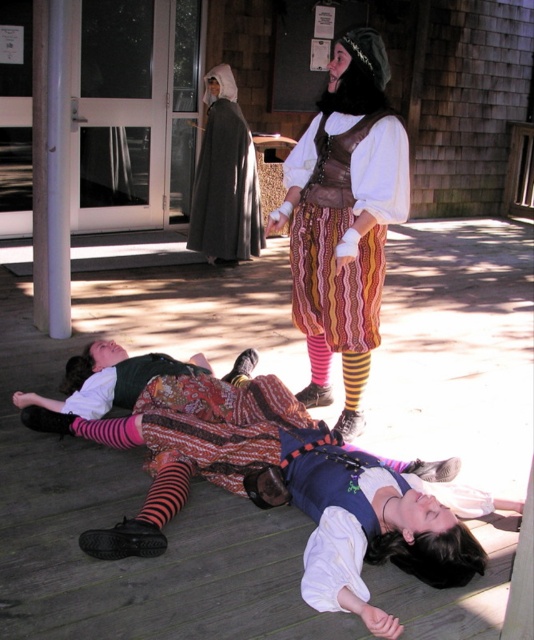
Question: Among these objects, which one is farthest from the camera?

Choices:
 (A) dark gray woolen cloak at center
 (B) pink striped sock at lower center
 (C) black striped sock at center

Answer: (A)

Question: Can you confirm if striped wool skirt at center is positioned to the right of black striped sock at center?

Choices:
 (A) yes
 (B) no

Answer: (B)

Question: Estimate the real-world distances between objects in this image. Which object is farther from the dark gray woolen cloak at center?

Choices:
 (A) black striped sock at center
 (B) striped wool skirt at center
 (C) pink striped sock at lower center

Answer: (A)

Question: Can you confirm if dark gray woolen cloak at center is positioned to the left of pink striped sock at lower center?

Choices:
 (A) no
 (B) yes

Answer: (B)

Question: Does dark gray woolen cloak at center appear under black striped sock at center?

Choices:
 (A) no
 (B) yes

Answer: (A)

Question: Which object appears farthest from the camera in this image?

Choices:
 (A) striped wool skirt at center
 (B) pink striped sock at lower center
 (C) dark gray woolen cloak at center

Answer: (C)